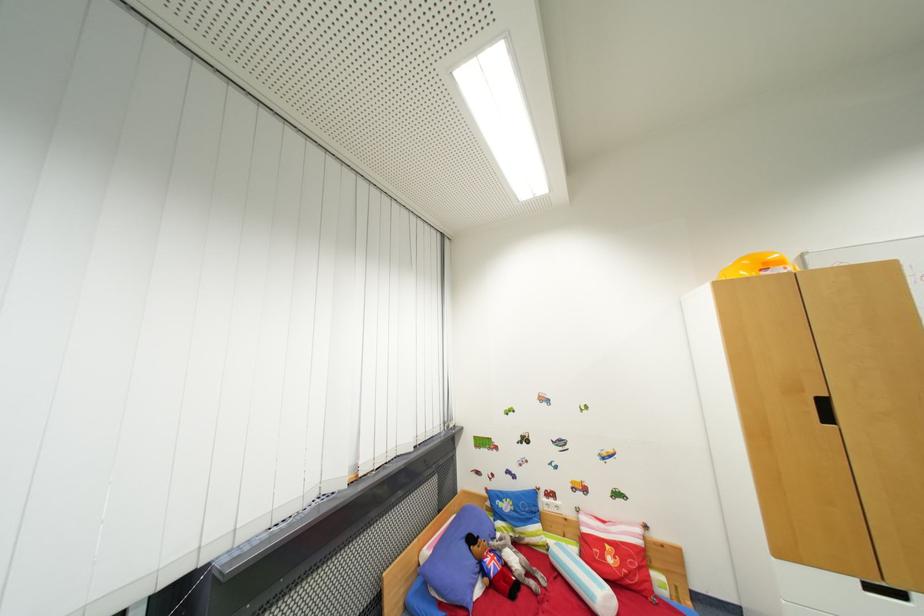
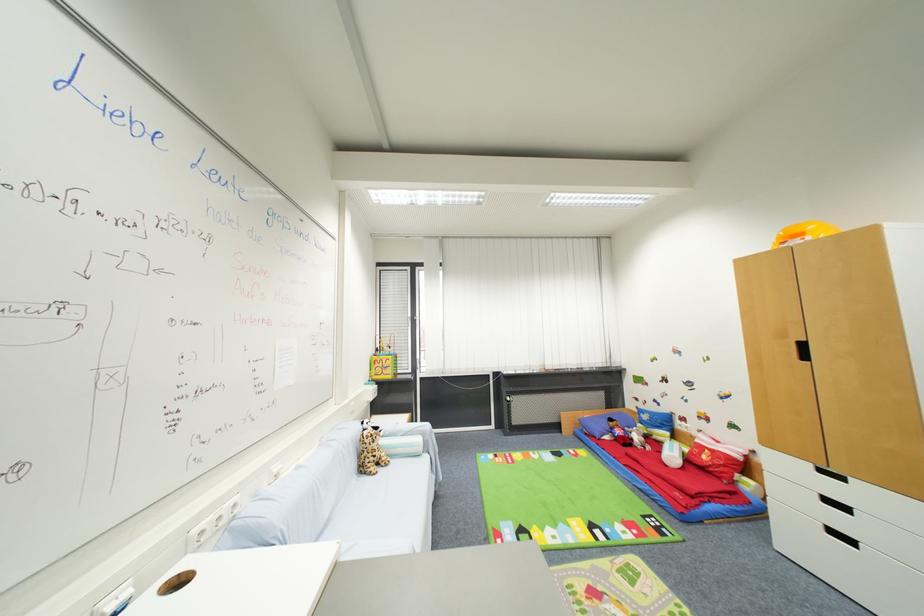
Where in the second image is the point corresponding to point 864,584 from the first image?

(816, 467)